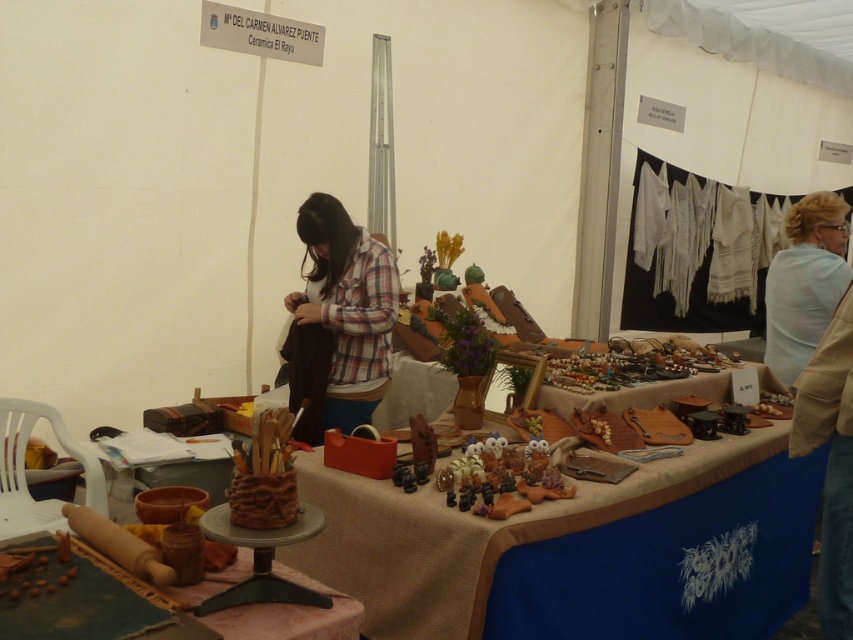
Question: Is plaid fabric shirt at center to the left of wooden rolling pin at center from the viewer's perspective?

Choices:
 (A) no
 (B) yes

Answer: (A)

Question: Which point is closer to the camera?

Choices:
 (A) plaid fabric shirt at center
 (B) light blue fabric at upper right
 (C) burlap tablecloth at center
 (D) wooden rolling pin at center

Answer: (D)

Question: Is plaid fabric shirt at center smaller than light blue fabric at upper right?

Choices:
 (A) yes
 (B) no

Answer: (A)

Question: Is burlap tablecloth at center in front of light blue fabric at upper right?

Choices:
 (A) yes
 (B) no

Answer: (A)

Question: Which point is farther to the camera?

Choices:
 (A) wooden rolling pin at center
 (B) burlap tablecloth at center

Answer: (B)

Question: Which is nearer to the burlap tablecloth at center?

Choices:
 (A) plaid fabric shirt at center
 (B) wooden rolling pin at center
 (C) light blue fabric at upper right

Answer: (B)